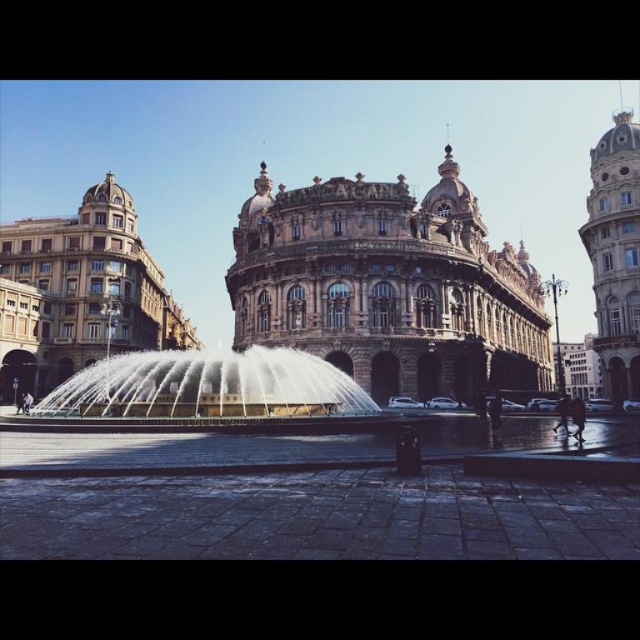
Question: In this image, where is golden stone building at left located relative to golden stone tower at upper right?

Choices:
 (A) right
 (B) left

Answer: (B)

Question: From the image, what is the correct spatial relationship of polished stone fountain at center in relation to golden stone palace at center?

Choices:
 (A) above
 (B) below

Answer: (A)

Question: Among these objects, which one is farthest from the camera?

Choices:
 (A) white marble fountain at center
 (B) polished stone fountain at center

Answer: (A)

Question: Which of these objects is positioned farthest from the golden stone tower at upper right?

Choices:
 (A) polished stone fountain at center
 (B) golden stone palace at center

Answer: (A)

Question: Is golden stone building at left bigger than white marble fountain at center?

Choices:
 (A) yes
 (B) no

Answer: (A)

Question: Which object is farther from the camera taking this photo?

Choices:
 (A) golden stone palace at center
 (B) polished stone fountain at center
 (C) golden stone building at left
 (D) white marble fountain at center

Answer: (C)